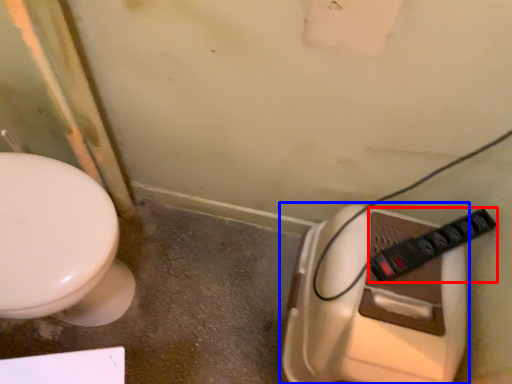
Question: Which of the following is the farthest to the observer, plug (highlighted by a red box) or toilet (highlighted by a blue box)?

Choices:
 (A) plug
 (B) toilet

Answer: (A)